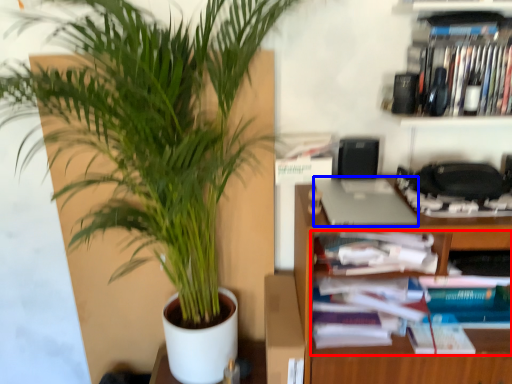
Question: Which point is closer to the camera, book (highlighted by a red box) or laptop (highlighted by a blue box)?

Choices:
 (A) book
 (B) laptop

Answer: (B)